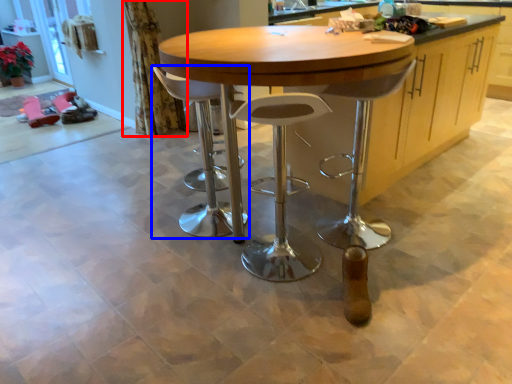
Question: Which object appears farthest to the camera in this image, curtain (highlighted by a red box) or stool (highlighted by a blue box)?

Choices:
 (A) curtain
 (B) stool

Answer: (A)